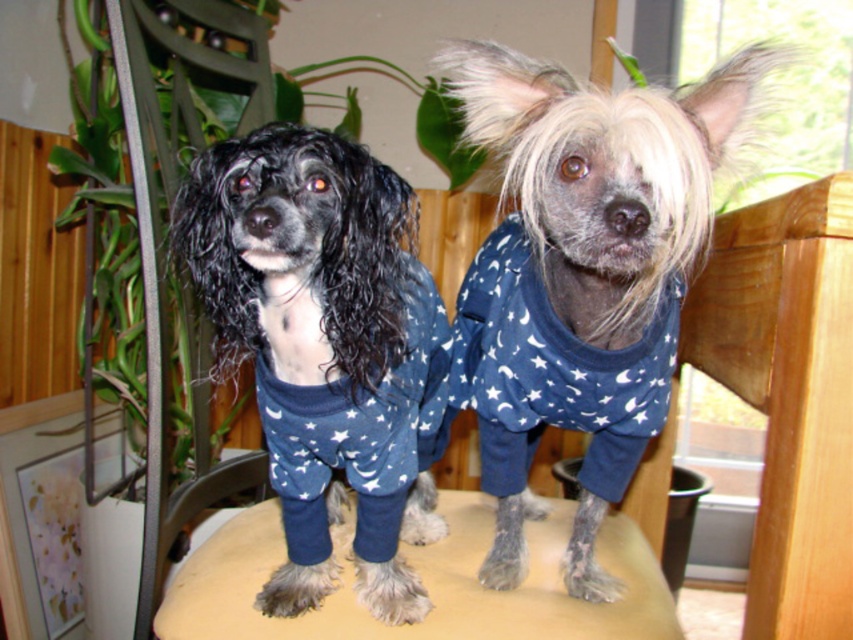
Can you confirm if shiny black fur at center is thinner than beige fabric stool at center?

Indeed, shiny black fur at center has a lesser width compared to beige fabric stool at center.

Which is behind, point (361, 218) or point (186, 621)?

Point (186, 621)

Find the location of a particular element. The width and height of the screenshot is (853, 640). shiny black fur at center is located at coordinates (321, 342).

Does blue star-patterned sweater at center have a greater height compared to beige fabric stool at center?

Yes, blue star-patterned sweater at center is taller than beige fabric stool at center.

Does blue star-patterned sweater at center come in front of beige fabric stool at center?

That is True.

Is point (660, 387) farther from camera compared to point (274, 531)?

No, (660, 387) is in front of (274, 531).

Where is `blue star-patterned sweater at center`? This screenshot has height=640, width=853. blue star-patterned sweater at center is located at coordinates (582, 275).

Does blue star-patterned sweater at center appear over shiny black fur at center?

Yes, blue star-patterned sweater at center is above shiny black fur at center.

Can you confirm if blue star-patterned sweater at center is positioned to the left of shiny black fur at center?

Incorrect, blue star-patterned sweater at center is not on the left side of shiny black fur at center.

The image size is (853, 640). Describe the element at coordinates (582, 275) in the screenshot. I see `blue star-patterned sweater at center` at that location.

Identify the location of blue star-patterned sweater at center. This screenshot has width=853, height=640. (582, 275).